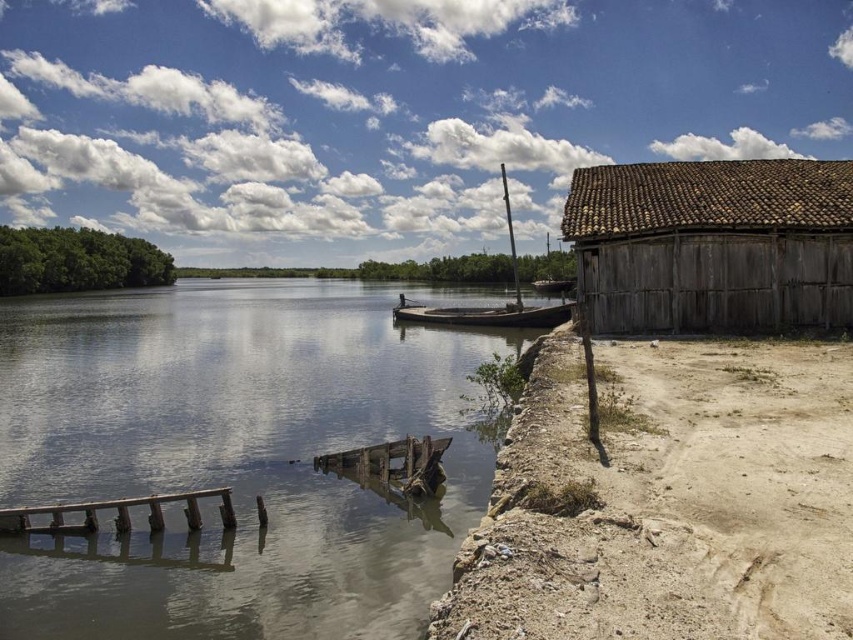
Who is positioned more to the right, brown wooden river at center or wooden boat at center?

From the viewer's perspective, wooden boat at center appears more on the right side.

This screenshot has width=853, height=640. What are the coordinates of `brown wooden river at center` in the screenshot? It's located at (234, 456).

Does wooden sailboat at center appear under wooden boat at center?

No, wooden sailboat at center is not below wooden boat at center.

Does point (413, 312) come behind point (506, 324)?

Yes, it is.

Who is more distant from viewer, (457, 317) or (474, 323)?

Point (457, 317)

Where is `wooden sailboat at center`? This screenshot has height=640, width=853. wooden sailboat at center is located at coordinates (490, 307).

Consider the image. Can you confirm if rusty wood dock at lower center is positioned to the left of rusty metal boat at center?

Yes, rusty wood dock at lower center is to the left of rusty metal boat at center.

Who is more distant from viewer, (392, 474) or (573, 278)?

Point (573, 278)

Is point (373, 448) farther from viewer compared to point (566, 284)?

That is False.

You are a GUI agent. You are given a task and a screenshot of the screen. Output one action in this format:
    pyautogui.click(x=<x>, y=<y>)
    Task: Click on the rusty wood dock at lower center
    
    Given the screenshot: What is the action you would take?
    pyautogui.click(x=393, y=465)